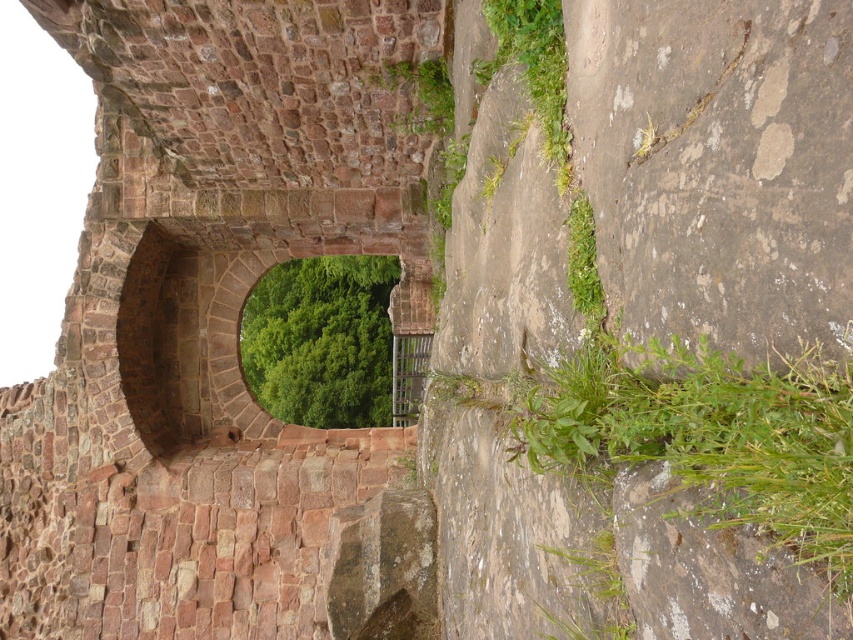
Who is shorter, green leafy plant at lower right or green leafy plant at upper right?

green leafy plant at upper right

Is green leafy plant at lower right above green leafy plant at upper right?

No, green leafy plant at lower right is not above green leafy plant at upper right.

I want to click on green leafy plant at lower right, so click(709, 436).

Locate an element on the screen. Image resolution: width=853 pixels, height=640 pixels. green leafy plant at lower right is located at coordinates (709, 436).

Does point (664, 392) come behind point (376, 298)?

No, (664, 392) is in front of (376, 298).

Does green leafy plant at lower right appear over green leafy vegetation at center?

No.

Locate an element on the screen. This screenshot has height=640, width=853. green leafy plant at lower right is located at coordinates (709, 436).

The width and height of the screenshot is (853, 640). In order to click on green leafy plant at lower right in this screenshot , I will do `click(709, 436)`.

Is green leafy vegetation at center further to the viewer compared to green leafy plant at upper right?

Yes, it is.

What are the coordinates of `green leafy vegetation at center` in the screenshot? It's located at (321, 340).